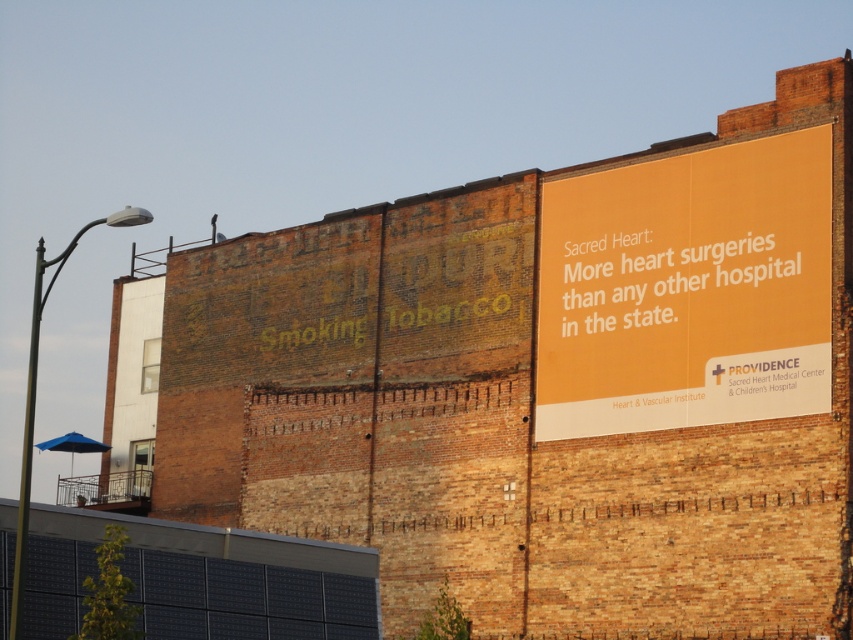
Can you confirm if matte orange sign at upper right is positioned to the left of orange matte sign at upper right?

Indeed, matte orange sign at upper right is positioned on the left side of orange matte sign at upper right.

Does matte orange sign at upper right have a lesser height compared to orange matte sign at upper right?

No.

Does point (738, 204) lie behind point (660, 262)?

No.

Locate an element on the screen. This screenshot has width=853, height=640. matte orange sign at upper right is located at coordinates (688, 289).